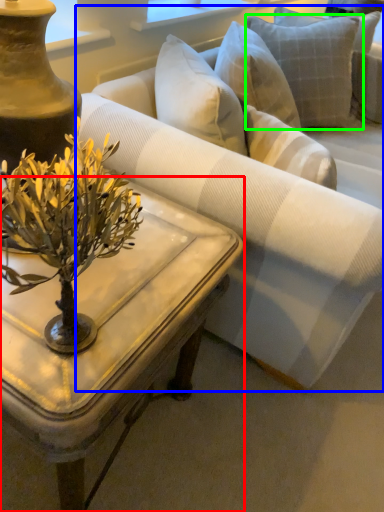
Question: Considering the real-world distances, which object is closest to coffee table (highlighted by a red box)? studio couch (highlighted by a blue box) or pillow (highlighted by a green box).

Choices:
 (A) studio couch
 (B) pillow

Answer: (A)